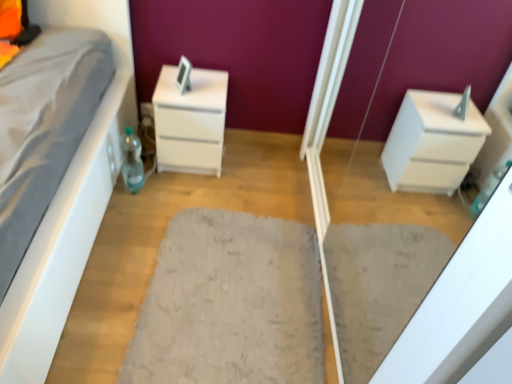
Question: Is white glossy chest of drawers at center far from white glossy drawer at right?

Choices:
 (A) no
 (B) yes

Answer: (A)

Question: Is white glossy chest of drawers at center bigger than white glossy drawer at right?

Choices:
 (A) yes
 (B) no

Answer: (B)

Question: From a real-world perspective, is white glossy chest of drawers at center under white glossy drawer at right?

Choices:
 (A) no
 (B) yes

Answer: (B)

Question: Would you say white glossy chest of drawers at center is outside white glossy drawer at right?

Choices:
 (A) yes
 (B) no

Answer: (A)

Question: Considering the relative sizes of white glossy chest of drawers at center and white glossy drawer at right in the image provided, is white glossy chest of drawers at center wider than white glossy drawer at right?

Choices:
 (A) yes
 (B) no

Answer: (A)

Question: From the image's perspective, is white glossy chest of drawers at center located beneath white glossy drawer at right?

Choices:
 (A) no
 (B) yes

Answer: (A)

Question: Is translucent plastic bottle at lower left not near white glossy chest of drawers at center?

Choices:
 (A) yes
 (B) no

Answer: (B)

Question: From the image's perspective, is translucent plastic bottle at lower left over white glossy chest of drawers at center?

Choices:
 (A) yes
 (B) no

Answer: (B)

Question: Considering the relative sizes of translucent plastic bottle at lower left and white glossy chest of drawers at center in the image provided, is translucent plastic bottle at lower left wider than white glossy chest of drawers at center?

Choices:
 (A) no
 (B) yes

Answer: (A)

Question: Considering the relative sizes of translucent plastic bottle at lower left and white glossy chest of drawers at center in the image provided, is translucent plastic bottle at lower left bigger than white glossy chest of drawers at center?

Choices:
 (A) no
 (B) yes

Answer: (A)

Question: Considering the relative sizes of translucent plastic bottle at lower left and white glossy chest of drawers at center in the image provided, is translucent plastic bottle at lower left smaller than white glossy chest of drawers at center?

Choices:
 (A) no
 (B) yes

Answer: (B)

Question: Can white glossy chest of drawers at center be found inside translucent plastic bottle at lower left?

Choices:
 (A) no
 (B) yes

Answer: (A)

Question: Considering the relative sizes of white glossy chest of drawers at center and translucent plastic bottle at lower left in the image provided, is white glossy chest of drawers at center bigger than translucent plastic bottle at lower left?

Choices:
 (A) yes
 (B) no

Answer: (A)